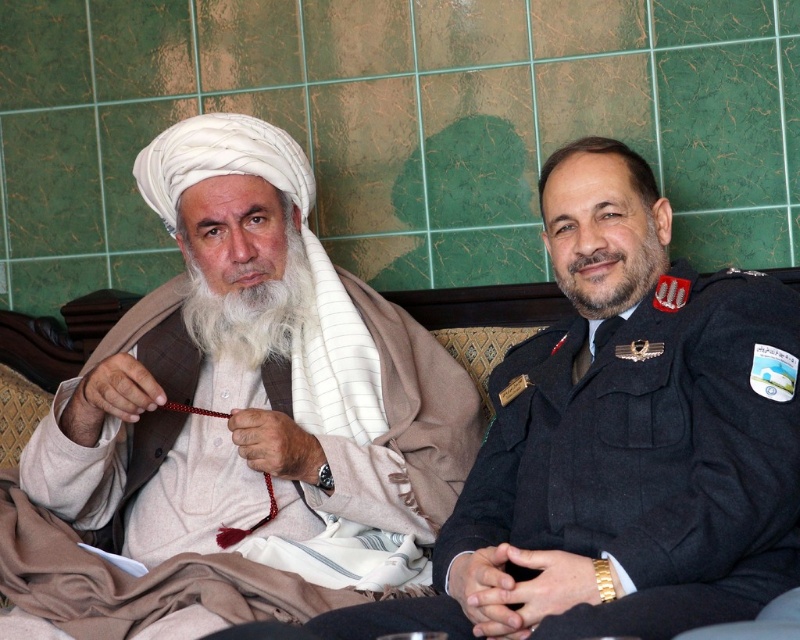
Question: Does dark blue uniform at right appear on the left side of white soft beard at left?

Choices:
 (A) yes
 (B) no

Answer: (B)

Question: Which point is farther from the camera taking this photo?

Choices:
 (A) (117, 444)
 (B) (226, 328)
 (C) (532, 384)
 (D) (606, 268)

Answer: (B)

Question: Is white woolen turban at left closer to camera compared to dark brown thick beard at right?

Choices:
 (A) no
 (B) yes

Answer: (B)

Question: Which object is positioned closest to the dark blue uniform at right?

Choices:
 (A) white woolen turban at left
 (B) dark brown thick beard at right
 (C) white soft beard at left

Answer: (B)

Question: Estimate the real-world distances between objects in this image. Which object is farther from the white soft beard at left?

Choices:
 (A) white woolen turban at left
 (B) dark brown thick beard at right
 (C) dark blue uniform at right

Answer: (C)

Question: In this image, where is dark blue uniform at right located relative to dark brown thick beard at right?

Choices:
 (A) below
 (B) above

Answer: (A)